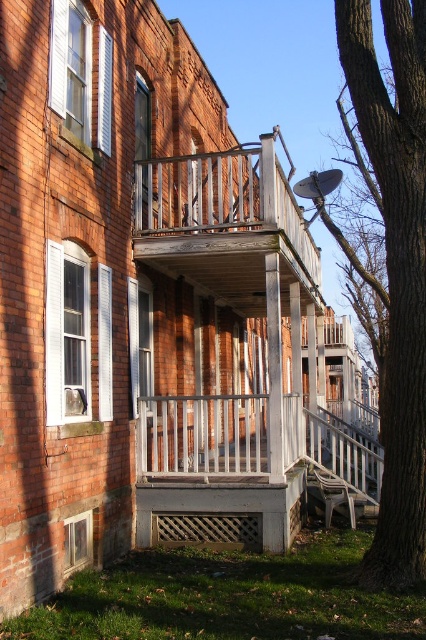
Question: Is weathered wood balcony at center to the right of white wooden balustrade at center from the viewer's perspective?

Choices:
 (A) no
 (B) yes

Answer: (B)

Question: Where is weathered wood balcony at center located in relation to white wooden balustrade at center in the image?

Choices:
 (A) above
 (B) below

Answer: (A)

Question: Considering the real-world distances, which object is farthest from the weathered wood balcony at center?

Choices:
 (A) brown rough bark tree at right
 (B) white wooden balustrade at center

Answer: (A)

Question: Estimate the real-world distances between objects in this image. Which object is farther from the weathered wood balcony at center?

Choices:
 (A) white wooden balustrade at center
 (B) brown rough bark tree at right

Answer: (B)

Question: Does brown rough bark tree at right have a lesser width compared to weathered wood balcony at center?

Choices:
 (A) yes
 (B) no

Answer: (A)

Question: Among these objects, which one is nearest to the camera?

Choices:
 (A) weathered wood balcony at center
 (B) white wooden balustrade at center

Answer: (B)